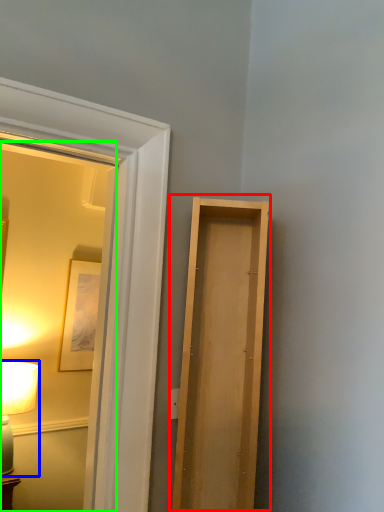
Question: Considering the real-world distances, which object is closest to door (highlighted by a red box)? table lamp (highlighted by a blue box) or mirror (highlighted by a green box).

Choices:
 (A) table lamp
 (B) mirror

Answer: (A)